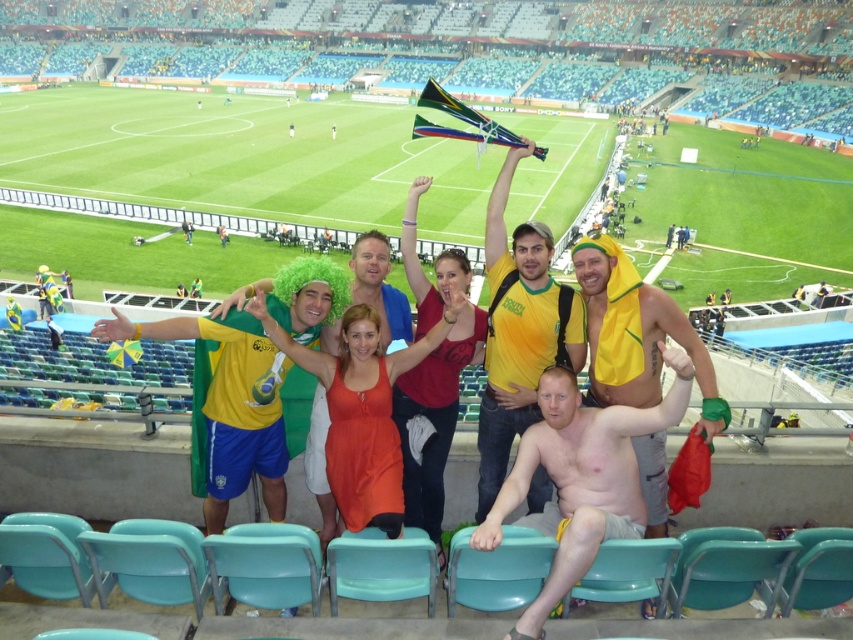
You are a photographer who wants to capture a closeup of the yellow fabric shirt at center and the yellow fabric towel at right. Which object should you focus on first if you want to include both in your shot without moving the camera?

The yellow fabric shirt at center is positioned on the left side of the yellow fabric towel at right, so you should focus on the yellow fabric shirt at center first to ensure both are in frame.

You are a photographer trying to capture a wide shot of the stadium scene. You notice the shiny metallic helmet at lower right and the yellow fabric shirt at center. Based on their positions, which object might block the view of the other if you move the camera slightly to the right?

The shiny metallic helmet at lower right might block the view of the yellow fabric shirt at center because it is wider and positioned closer to the right side of the frame.

You are a photographer trying to capture a clear shot of both the shiny metallic helmet at lower right and the yellow fabric shirt at center. Since you want both to be visible, which object should you focus on first to ensure proper framing?

The shiny metallic helmet at lower right is bigger than the yellow fabric shirt at center, so you should focus on the shiny metallic helmet at lower right first to ensure it fits within the frame before adjusting for the smaller yellow fabric shirt at center.